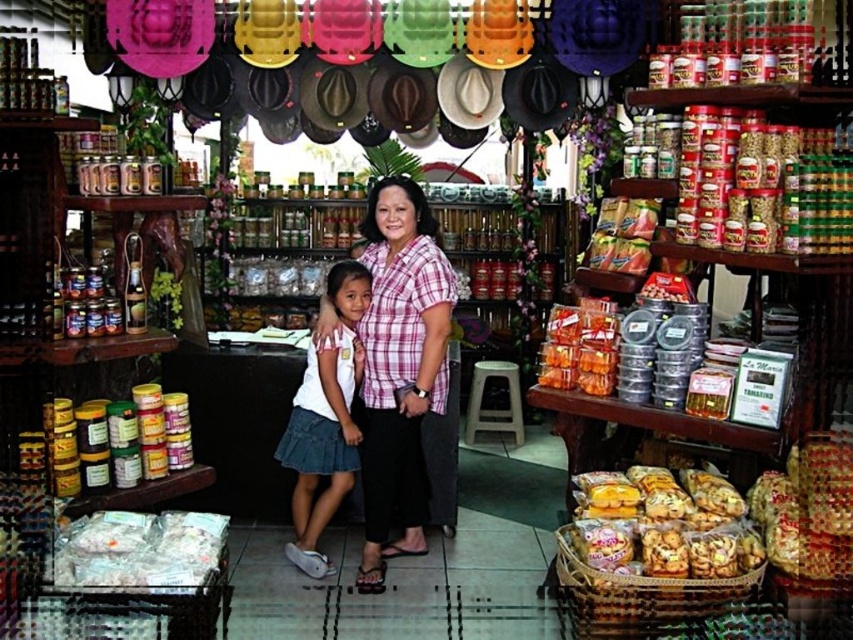
Question: Among these objects, which one is farthest from the camera?

Choices:
 (A) pink plaid shirt at center
 (B) translucent plastic containers at center right
 (C) white translucent bag at center

Answer: (A)

Question: Which is nearer to the translucent plastic containers at center right?

Choices:
 (A) white translucent bag at center
 (B) translucent plastic bag of cookies at center
 (C) white cotton shirt at center
 (D) pink plaid shirt at center

Answer: (B)

Question: Does white cotton shirt at center have a larger size compared to translucent plastic containers at center right?

Choices:
 (A) no
 (B) yes

Answer: (B)

Question: Which of the following is the farthest from the observer?

Choices:
 (A) white translucent bag at center
 (B) pink plaid shirt at center

Answer: (B)

Question: Does translucent plastic bag of cookies at center appear over white translucent bag at center?

Choices:
 (A) no
 (B) yes

Answer: (B)

Question: Observing the image, what is the correct spatial positioning of white cotton shirt at center in reference to translucent plastic containers at center right?

Choices:
 (A) right
 (B) left

Answer: (B)